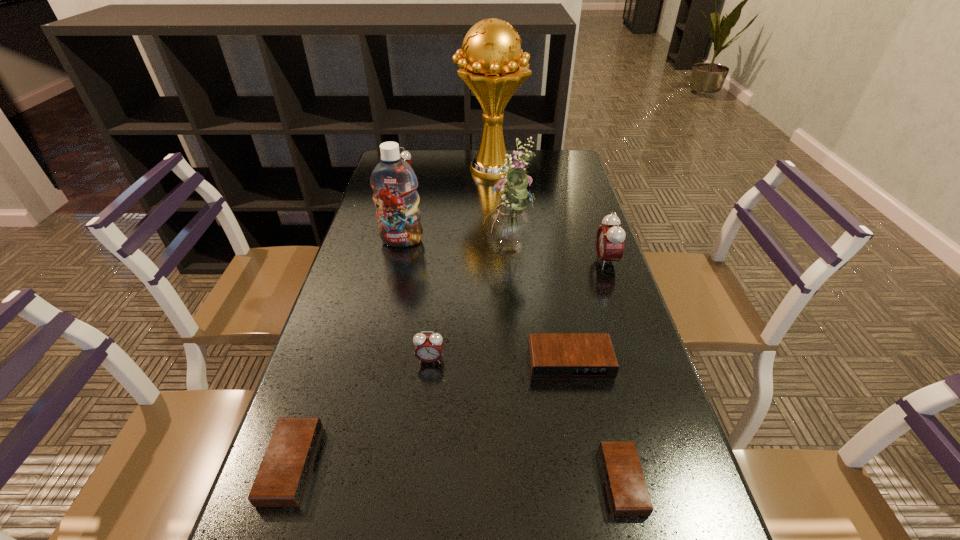
Image resolution: width=960 pixels, height=540 pixels. What are the coordinates of `vacant space located 0.330m on the front-facing side of the bouquet` in the screenshot? It's located at (367, 256).

Locate an element on the screen. The height and width of the screenshot is (540, 960). free spot located on the front-facing side of the bouquet is located at coordinates (349, 256).

This screenshot has width=960, height=540. I want to click on free space located on the front-facing side of the bouquet, so click(x=455, y=256).

Locate an element on the screen. This screenshot has height=540, width=960. free space located on the front label of the shampoo is located at coordinates (386, 312).

At what (x,y) coordinates should I click in order to perform the action: click on free space located on the clock face of the second nearest pink alarm clock. Please return your answer as a coordinate pair (x, y). This screenshot has height=540, width=960. Looking at the image, I should click on click(468, 261).

Identify the location of vacant area situated 0.060m on the clock face of the second nearest pink alarm clock. (575, 261).

Where is `vacant space located 0.110m on the clock face of the second nearest pink alarm clock`? This screenshot has height=540, width=960. vacant space located 0.110m on the clock face of the second nearest pink alarm clock is located at coordinates (557, 261).

Locate an element on the screen. The width and height of the screenshot is (960, 540). vacant region located on the clock face of the second tallest alarm clock is located at coordinates 391,219.

You are a GUI agent. You are given a task and a screenshot of the screen. Output one action in this format:
    pyautogui.click(x=<x>, y=<y>)
    Task: Click on the blank space located on the clock face of the fourth shortest alarm clock
    
    Given the screenshot: What is the action you would take?
    pyautogui.click(x=413, y=516)

Identify the location of vacant space located 0.290m on the front face of the fourth tallest alarm clock. (602, 528).